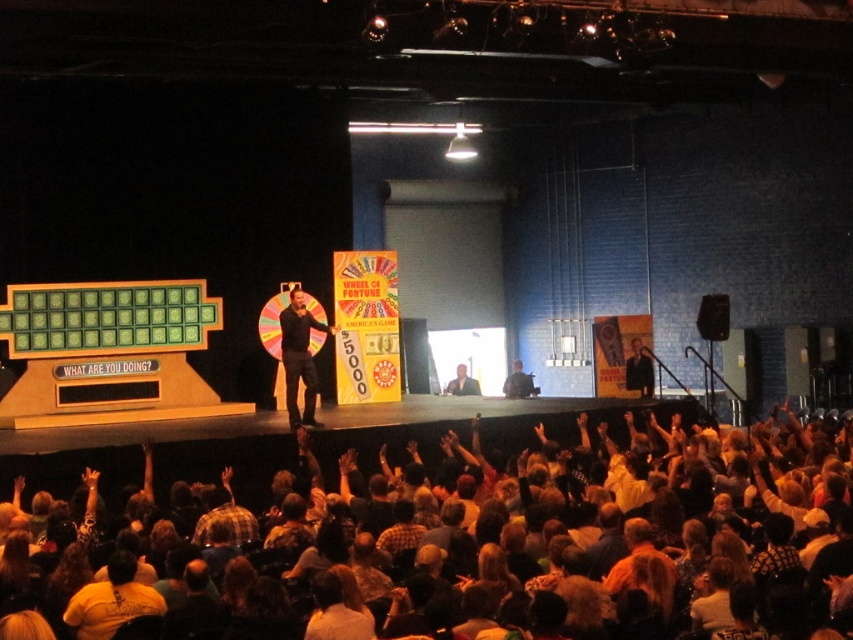
You are a stagehand preparing to adjust the lighting for the host wearing the matte black suit at center and the dark brown leather hand at upper center. Which object should you focus on first if you need to light the higher positioned one?

The matte black suit at center is located above the dark brown leather hand at upper center, so you should focus on lighting the matte black suit at center first.

You are a contestant on the game show and see the plaid fabric shirt at lower center and the camouflage fabric shirt at center. Which shirt is shorter in height?

The plaid fabric shirt at lower center has a lesser height compared to the camouflage fabric shirt at center, so the plaid fabric shirt at lower center is shorter.